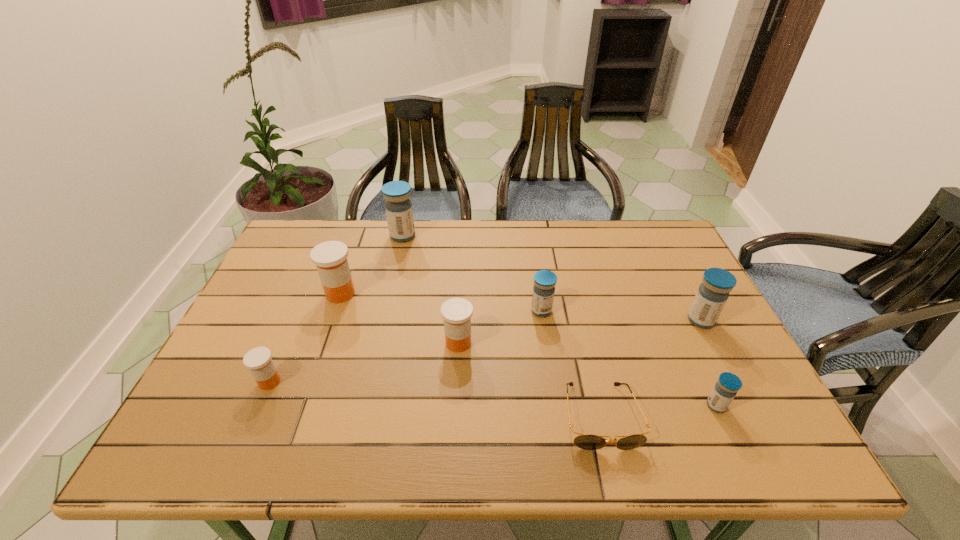
The height and width of the screenshot is (540, 960). Find the location of `vacant region located on the left of the second blue medicine from left to right`. vacant region located on the left of the second blue medicine from left to right is located at coordinates (427, 311).

Locate an element on the screen. vacant position located 0.180m on the label of the leftmost medicine is located at coordinates (359, 382).

Find the location of a particular element. free region located on the back of the smallest blue medicine is located at coordinates (664, 293).

Locate an element on the screen. object present at the far edge is located at coordinates (398, 206).

Where is `object that is at the near edge`? The image size is (960, 540). object that is at the near edge is located at coordinates (584, 441).

I want to click on object located at the left edge, so click(x=258, y=360).

This screenshot has width=960, height=540. In the image, there is a desktop. What are the coordinates of `vacant area at the far edge` in the screenshot? It's located at (385, 247).

Locate an element on the screen. vacant area at the near edge of the desktop is located at coordinates (295, 455).

In the image, there is a desktop. Identify the location of vacant region at the left edge. (288, 351).

This screenshot has height=540, width=960. What are the coordinates of `vacant space at the near right corner of the desktop` in the screenshot? It's located at (776, 452).